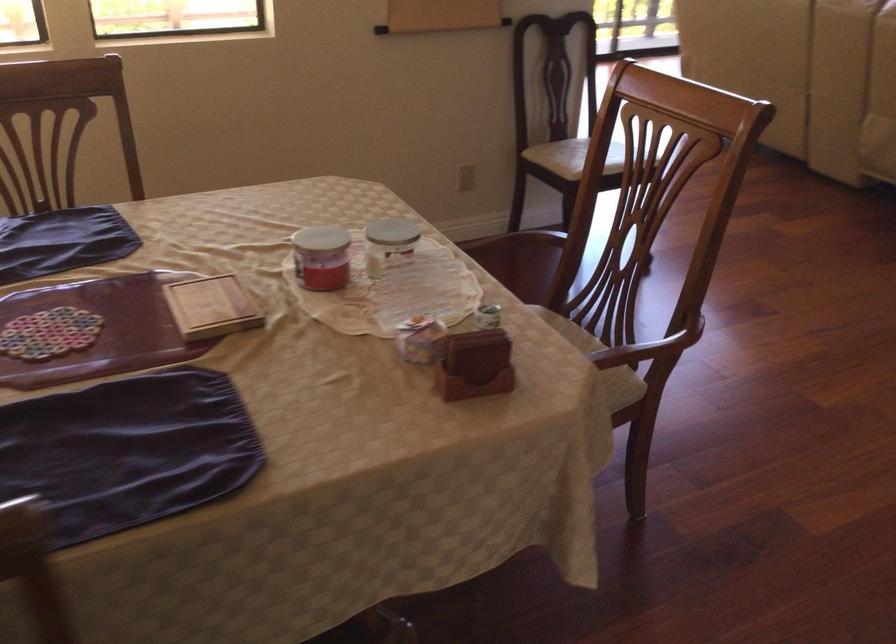
Image resolution: width=896 pixels, height=644 pixels. What are the coordinates of `wooden chair armrest` in the screenshot? It's located at (642, 351).